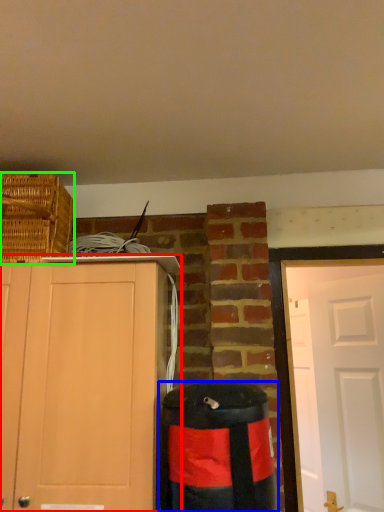
Question: Which object is positioned closest to cabinetry (highlighted by a red box)? Select from waste container (highlighted by a blue box) and basket (highlighted by a green box).

Choices:
 (A) waste container
 (B) basket

Answer: (A)